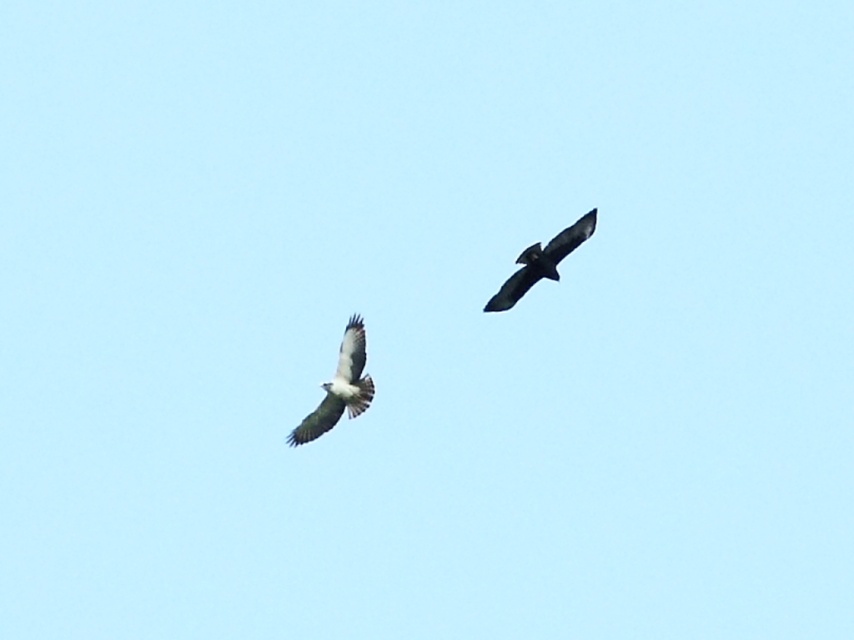
Does white feathered eagle at center come in front of dark brown feathers at upper right?

That is False.

Measure the distance between white feathered eagle at center and camera.

They are 265.45 feet apart.

Find the location of `white feathered eagle at center`. white feathered eagle at center is located at coordinates (338, 387).